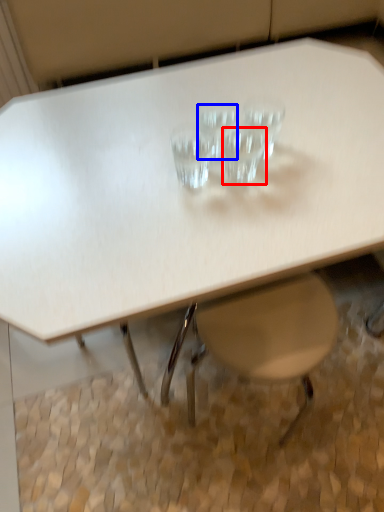
Question: Which point is closer to the camera, martini glass (highlighted by a red box) or martini glass (highlighted by a blue box)?

Choices:
 (A) martini glass
 (B) martini glass

Answer: (A)